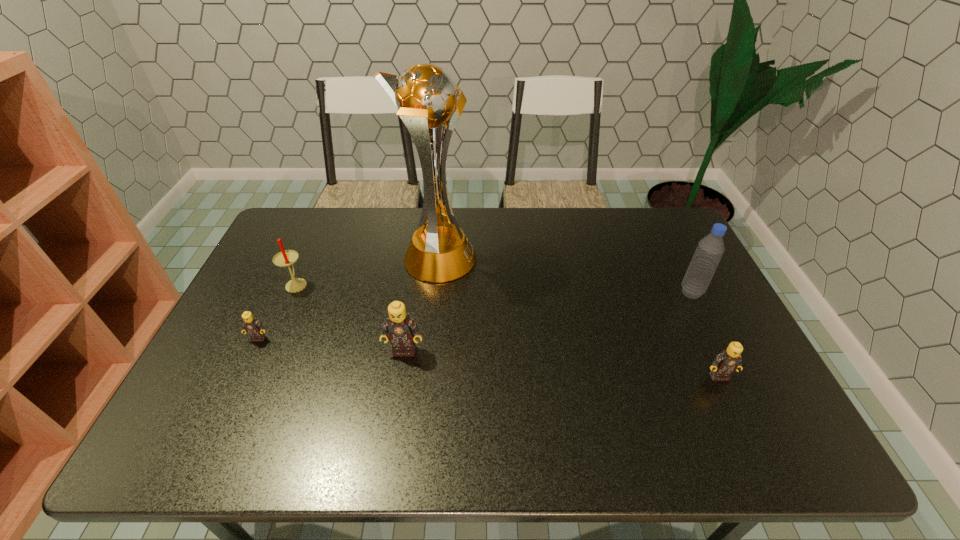
This screenshot has width=960, height=540. Find the location of `blank space at the far edge of the desktop`. blank space at the far edge of the desktop is located at coordinates (465, 217).

Locate an element on the screen. Image resolution: width=960 pixels, height=540 pixels. vacant space at the near edge is located at coordinates (315, 412).

Image resolution: width=960 pixels, height=540 pixels. Find the location of `vacant space at the left edge of the desktop`. vacant space at the left edge of the desktop is located at coordinates (269, 310).

In the image, there is a desktop. Find the location of `free region at the right edge`. free region at the right edge is located at coordinates [x=671, y=302].

Locate an element on the screen. The height and width of the screenshot is (540, 960). free space at the far left corner of the desktop is located at coordinates (319, 230).

Find the location of a particular element. The height and width of the screenshot is (540, 960). blank space at the near left corner is located at coordinates click(x=235, y=401).

In the image, there is a desktop. Where is `free space at the far right corner`? The image size is (960, 540). free space at the far right corner is located at coordinates (669, 235).

Find the location of a particular element. vacant point located between the trophy and the second nearest object is located at coordinates (420, 305).

Where is `free space between the fourth farthest object and the tallest object`? The image size is (960, 540). free space between the fourth farthest object and the tallest object is located at coordinates (348, 299).

Where is `vacant area that lies between the leftmost Lego and the second Lego from left to right`? vacant area that lies between the leftmost Lego and the second Lego from left to right is located at coordinates (331, 344).